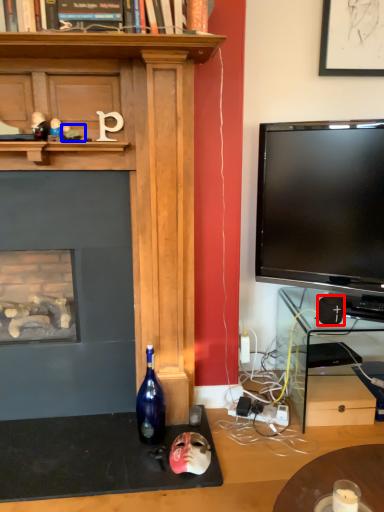
Question: Which object appears closest to the camera in this image, speaker (highlighted by a red box) or toy (highlighted by a blue box)?

Choices:
 (A) speaker
 (B) toy

Answer: (B)